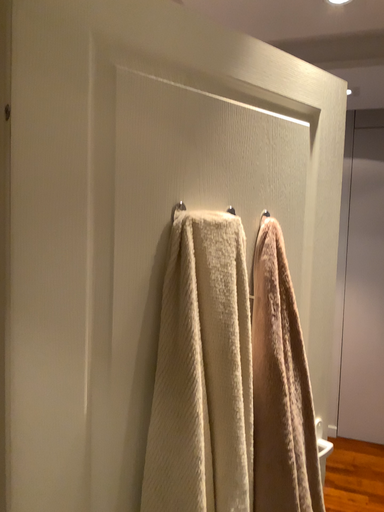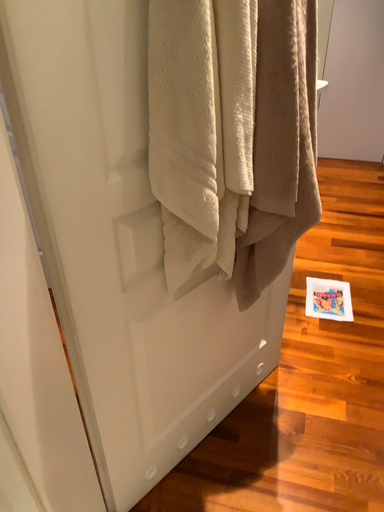
Question: How did the camera likely rotate when shooting the video?

Choices:
 (A) rotated downward
 (B) rotated upward

Answer: (A)